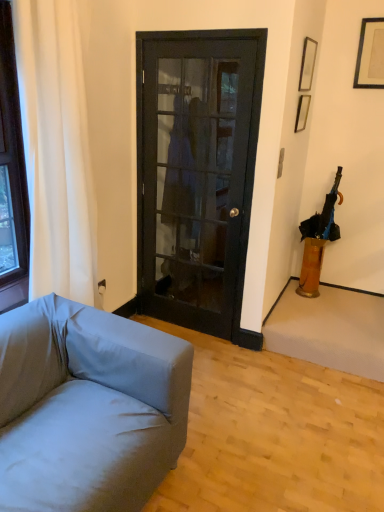
Question: From the image's perspective, is black glass door at center positioned above or below black fabric umbrella at right?

Choices:
 (A) above
 (B) below

Answer: (A)

Question: Is black glass door at center inside or outside of black fabric umbrella at right?

Choices:
 (A) outside
 (B) inside

Answer: (A)

Question: Estimate the real-world distances between objects in this image. Which object is farther from the translucent amber vase at right?

Choices:
 (A) matte black picture frame at upper right, which appears as the second picture frame when viewed from the right
 (B) black glass door at center
 (C) white fabric curtain at left
 (D) metallic gold picture frame at upper right, arranged as the first picture frame when viewed from the left
 (E) black matte picture frame at upper right, the 1th picture frame when ordered from right to left

Answer: (C)

Question: Considering the real-world distances, which object is farthest from the metallic gold picture frame at upper right, arranged as the first picture frame when viewed from the left?

Choices:
 (A) translucent amber vase at right
 (B) light gray fabric couch at lower left
 (C) black glass door at center
 (D) black fabric umbrella at right
 (E) black matte picture frame at upper right, the 3th picture frame in the left-to-right sequence

Answer: (B)